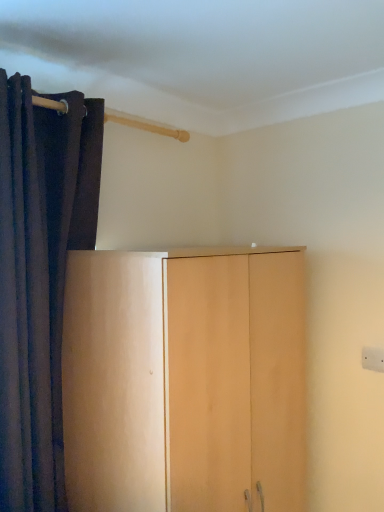
What do you see at coordinates (185, 380) in the screenshot? I see `light wood cupboard at center` at bounding box center [185, 380].

Measure the distance between point (203, 498) and camera.

They are 1.25 meters apart.

Find the location of `light wood cupboard at center`. light wood cupboard at center is located at coordinates (185, 380).

The image size is (384, 512). I want to click on dark velvet curtain at left, so click(40, 276).

What do you see at coordinates (40, 276) in the screenshot? I see `dark velvet curtain at left` at bounding box center [40, 276].

Locate an element on the screen. light wood cupboard at center is located at coordinates (185, 380).

In the scene shown: Between dark velvet curtain at left and light wood cupboard at center, which one appears on the left side from the viewer's perspective?

Positioned to the left is dark velvet curtain at left.

Considering the positions of objects dark velvet curtain at left and light wood cupboard at center in the image provided, who is in front, dark velvet curtain at left or light wood cupboard at center?

Positioned in front is light wood cupboard at center.

Considering the positions of point (38, 307) and point (246, 437), is point (38, 307) closer or farther from the camera than point (246, 437)?

Clearly, point (38, 307) is closer to the camera than point (246, 437).

From the image's perspective, is dark velvet curtain at left located above or below light wood cupboard at center?

dark velvet curtain at left is above light wood cupboard at center.

From a real-world perspective, who is located higher, dark velvet curtain at left or light wood cupboard at center?

dark velvet curtain at left is physically above.

Which of these two, dark velvet curtain at left or light wood cupboard at center, is thinner?

dark velvet curtain at left.

Who is shorter, dark velvet curtain at left or light wood cupboard at center?

light wood cupboard at center is shorter.

Who is bigger, dark velvet curtain at left or light wood cupboard at center?

light wood cupboard at center.

Does dark velvet curtain at left contain light wood cupboard at center?

That's incorrect, light wood cupboard at center is not inside dark velvet curtain at left.

Is dark velvet curtain at left beside light wood cupboard at center?

No, dark velvet curtain at left is not beside light wood cupboard at center.

Is dark velvet curtain at left facing away from light wood cupboard at center?

dark velvet curtain at left is not turned away from light wood cupboard at center.

Measure the distance between dark velvet curtain at left and light wood cupboard at center.

dark velvet curtain at left is 15.59 inches away from light wood cupboard at center.

Where is `curtain located behind the light wood cupboard at center`? curtain located behind the light wood cupboard at center is located at coordinates (40, 276).

Between light wood cupboard at center and dark velvet curtain at left, which one appears on the left side from the viewer's perspective?

Positioned to the left is dark velvet curtain at left.

Is light wood cupboard at center positioned behind dark velvet curtain at left?

No, light wood cupboard at center is closer to the camera.

Which is less distant, (x=208, y=294) or (x=84, y=204)?

Clearly, point (x=208, y=294) is closer to the camera than point (x=84, y=204).

From the image's perspective, relative to dark velvet curtain at left, is light wood cupboard at center above or below?

From the image's perspective, light wood cupboard at center appears below dark velvet curtain at left.

From a real-world perspective, which is physically below, light wood cupboard at center or dark velvet curtain at left?

In real-world perspective, light wood cupboard at center is lower.

Is light wood cupboard at center wider than dark velvet curtain at left?

Yes, light wood cupboard at center is wider than dark velvet curtain at left.

Considering the sizes of objects light wood cupboard at center and dark velvet curtain at left in the image provided, who is shorter, light wood cupboard at center or dark velvet curtain at left?

Standing shorter between the two is light wood cupboard at center.

Looking at the image, does light wood cupboard at center seem bigger or smaller compared to dark velvet curtain at left?

Clearly, light wood cupboard at center is larger in size than dark velvet curtain at left.

Would you say light wood cupboard at center is outside dark velvet curtain at left?

light wood cupboard at center is positioned outside dark velvet curtain at left.

Does light wood cupboard at center touch dark velvet curtain at left?

No, light wood cupboard at center is not with dark velvet curtain at left.

Could you tell me if light wood cupboard at center is facing dark velvet curtain at left?

No, light wood cupboard at center is not turned towards dark velvet curtain at left.

Can you tell me how much light wood cupboard at center and dark velvet curtain at left differ in facing direction?

The angular difference between light wood cupboard at center and dark velvet curtain at left is 0.367 degrees.

Measure the distance between light wood cupboard at center and dark velvet curtain at left.

light wood cupboard at center and dark velvet curtain at left are 15.59 inches apart from each other.

Identify the location of cupboard located on the right of dark velvet curtain at left. (185, 380).

Where is `curtain above the light wood cupboard at center (from the image's perspective)`? The width and height of the screenshot is (384, 512). curtain above the light wood cupboard at center (from the image's perspective) is located at coordinates (40, 276).

Find the location of a particular element. The width and height of the screenshot is (384, 512). curtain behind the light wood cupboard at center is located at coordinates (40, 276).